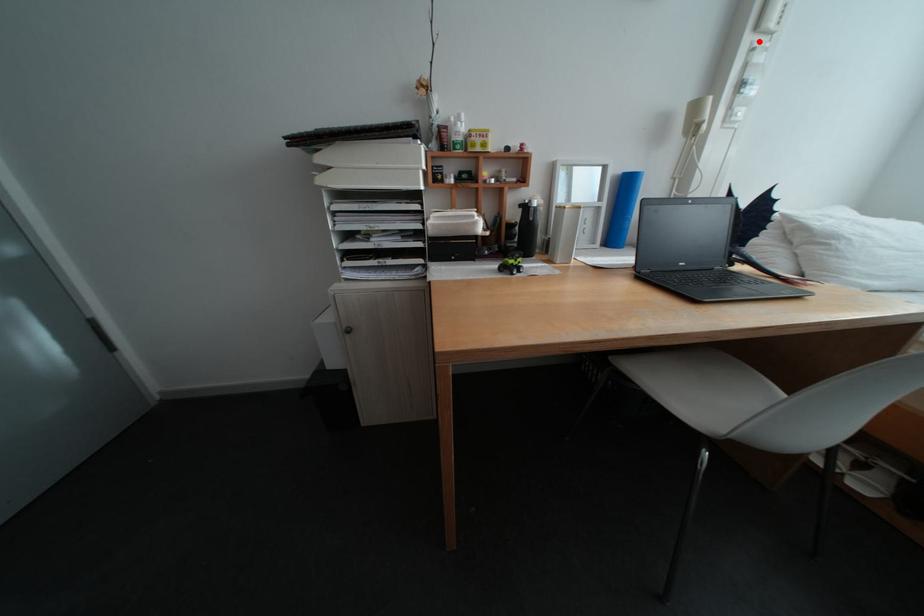
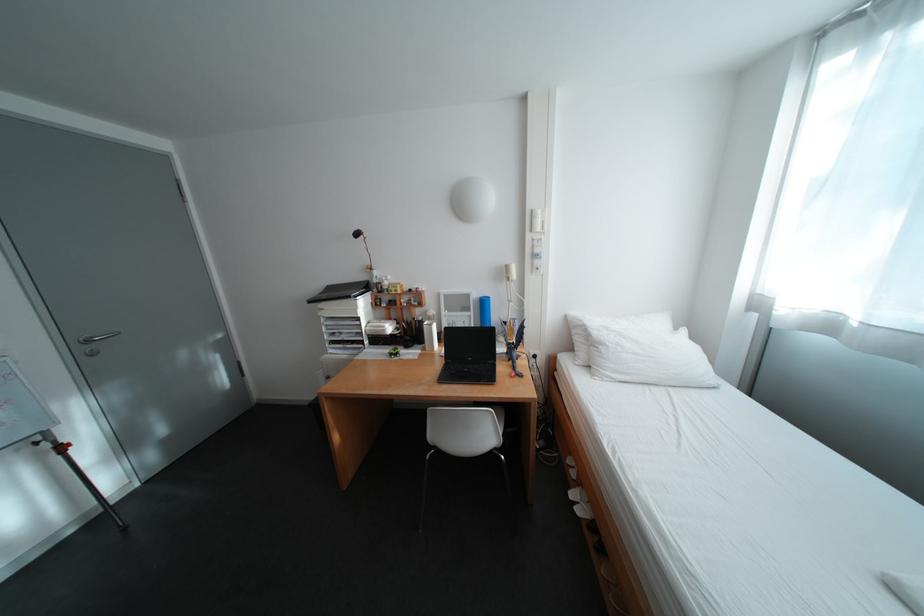
Find the pixel in the second image that matches the highlighted location in the first image.

(541, 237)